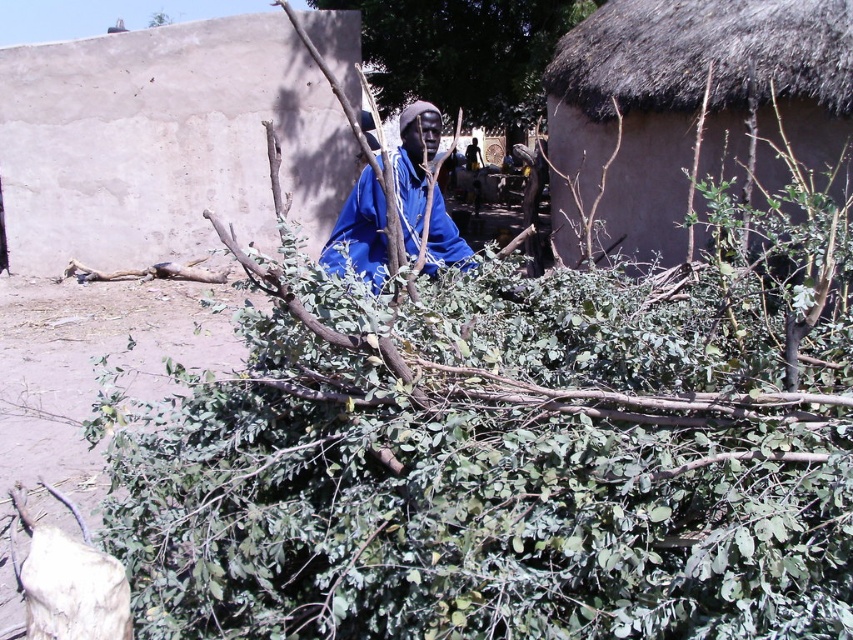
What do you see at coordinates (463, 52) in the screenshot?
I see `green leafy bush at center` at bounding box center [463, 52].

Can you confirm if green leafy bush at center is positioned above blue matte robe at center?

Yes, green leafy bush at center is above blue matte robe at center.

Is point (412, 12) farther from camera compared to point (438, 212)?

Yes.

Where is `green leafy bush at center`? green leafy bush at center is located at coordinates (463, 52).